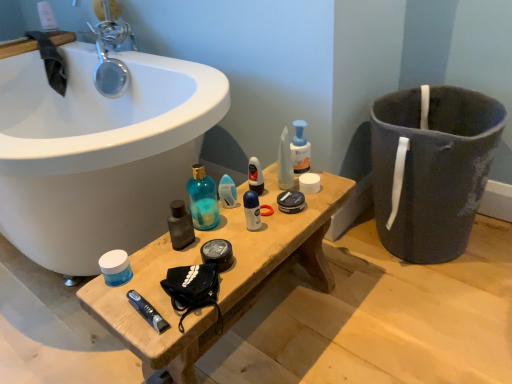
Where is `free space in front of dark gray fabric trash bin/can at right`? This screenshot has width=512, height=384. free space in front of dark gray fabric trash bin/can at right is located at coordinates (436, 312).